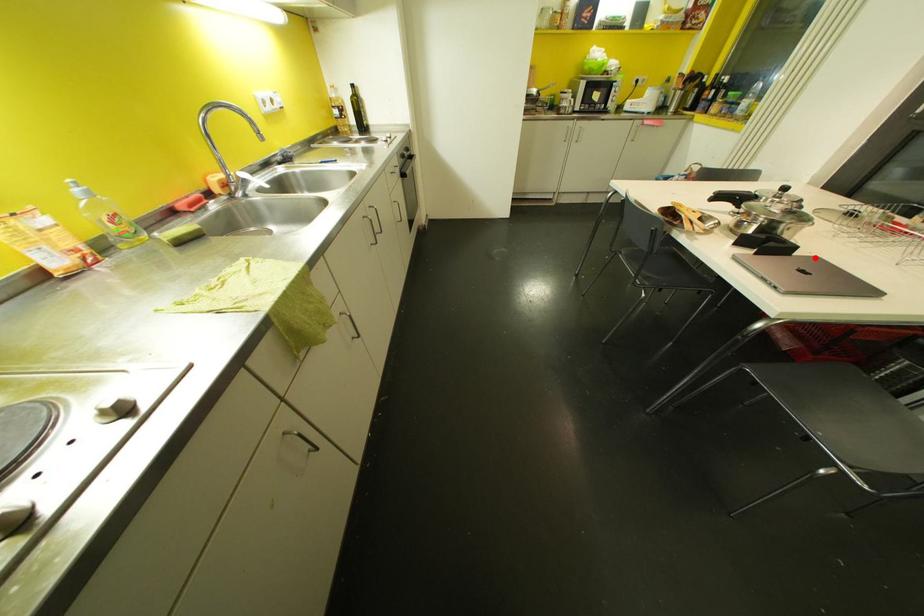
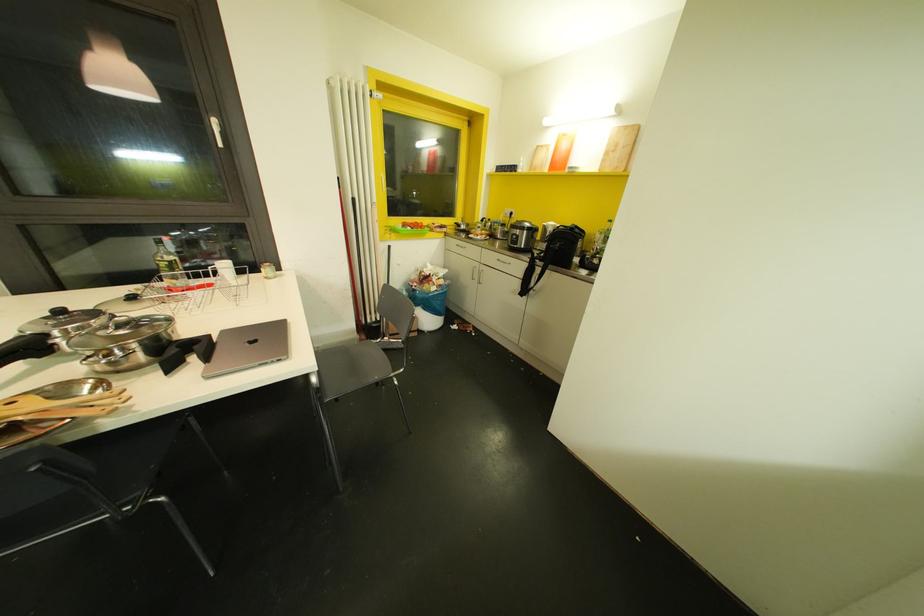
Question: I am providing you with two images of the same scene from different viewpoints. A red point is marked on the first image. Is the red point's position out of view in image 2?

Choices:
 (A) Yes
 (B) No

Answer: (B)